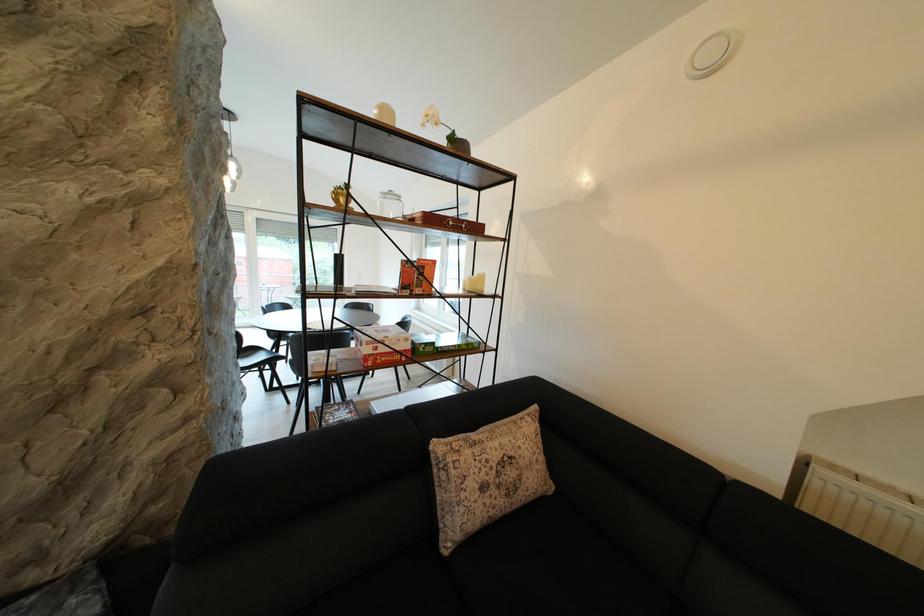
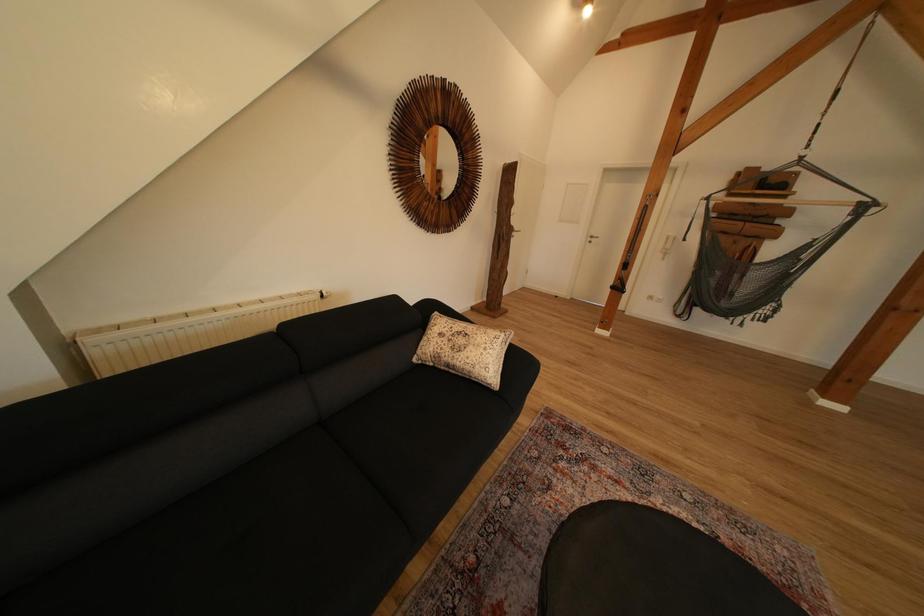
The images are taken continuously from a first-person perspective. In which direction is your viewpoint rotating?

The camera rotated toward right-down.